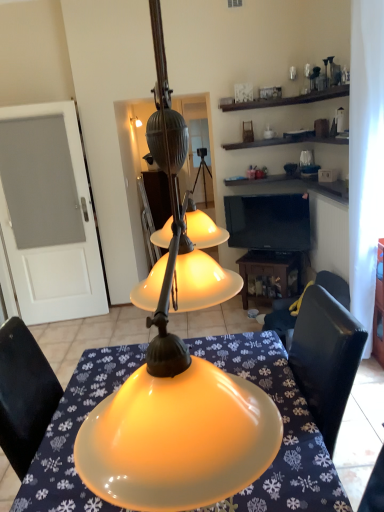
Question: From the image's perspective, is white sheer curtain at right positioned above or below matte yellow glass lampshade at center?

Choices:
 (A) above
 (B) below

Answer: (A)

Question: From a real-world perspective, is white sheer curtain at right above or below matte yellow glass lampshade at center?

Choices:
 (A) below
 (B) above

Answer: (A)

Question: Which of these objects is positioned closest to the matte yellow glass lampshade at center?

Choices:
 (A) black glossy tv at upper right
 (B) black leather chair at lower right
 (C) white sheer curtain at right
 (D) matte yellow lampshade at center
 (E) white frosted glass door at left

Answer: (D)

Question: Considering the real-world distances, which object is farthest from the white frosted glass door at left?

Choices:
 (A) wooden table at lower center
 (B) white sheer curtain at right
 (C) black leather chair at lower right
 (D) black glossy tv at upper right
 (E) matte yellow lampshade at center

Answer: (B)